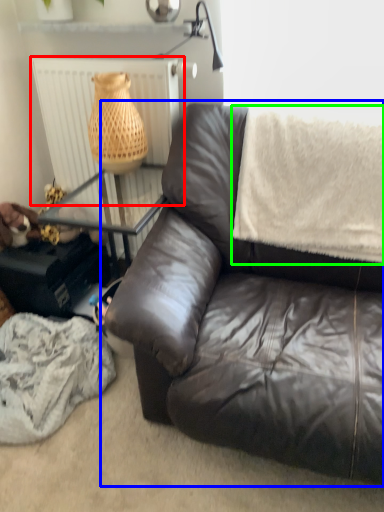
Question: Which object is positioned farthest from radiator (highlighted by a red box)? Select from studio couch (highlighted by a blue box) and blanket (highlighted by a green box).

Choices:
 (A) studio couch
 (B) blanket

Answer: (A)